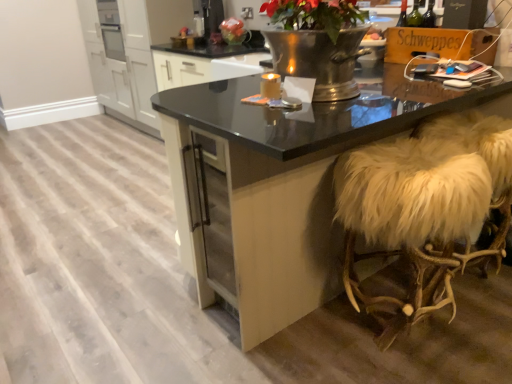
Where is `vacant space that's between white fur-covered stool at right and black glossy table at center`? The image size is (512, 384). vacant space that's between white fur-covered stool at right and black glossy table at center is located at coordinates (439, 317).